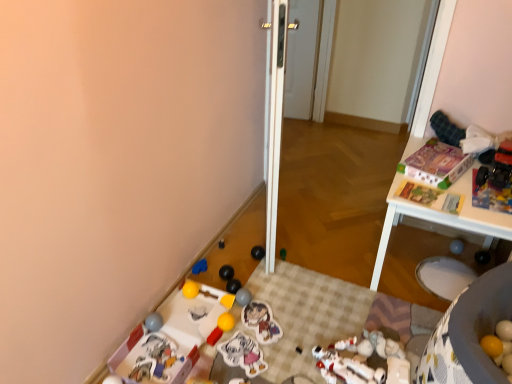
You are a GUI agent. You are given a task and a screenshot of the screen. Output one action in this format:
    pyautogui.click(x=<x>, y=<y>)
    Task: Click on the vacant area on the back side of yellow matte toy at lower center, acting as the 12th toy starting from the right
    
    Given the screenshot: What is the action you would take?
    pyautogui.click(x=224, y=279)